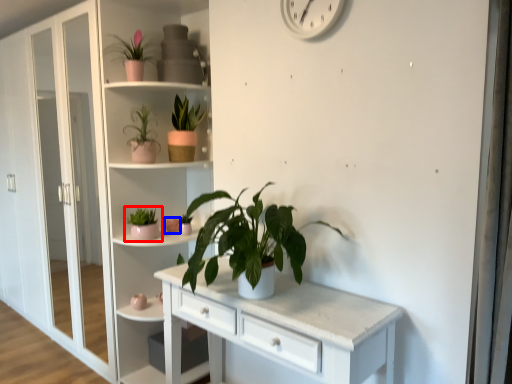
Question: Which object appears farthest to the camera in this image, houseplant (highlighted by a red box) or flower (highlighted by a blue box)?

Choices:
 (A) houseplant
 (B) flower

Answer: (B)